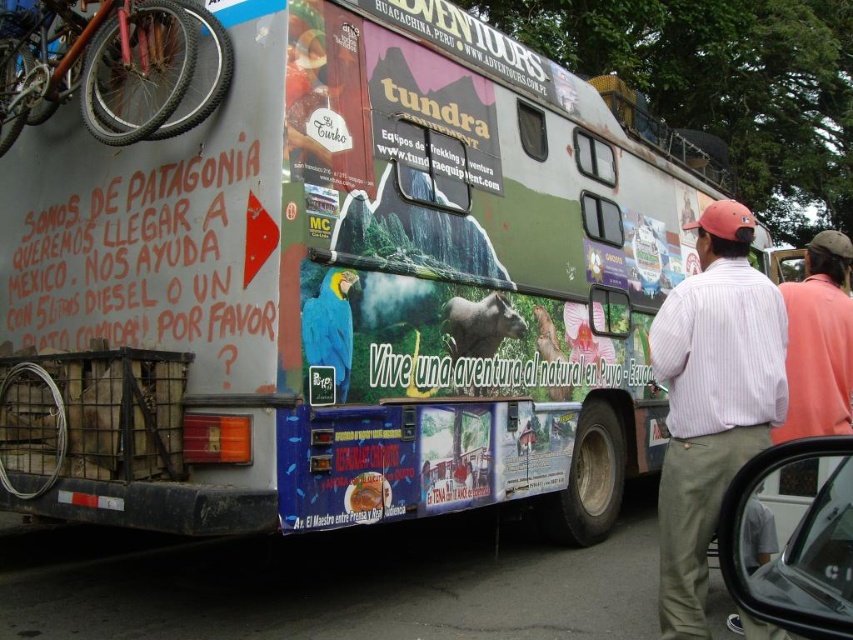
Question: Which of the following is the closest to the observer?

Choices:
 (A) (44, 58)
 (B) (711, 385)

Answer: (B)

Question: Does striped cotton shirt at right appear over orange matte bicycle at upper left?

Choices:
 (A) yes
 (B) no

Answer: (B)

Question: Is striped cotton shirt at right to the left of orange matte bicycle at upper left from the viewer's perspective?

Choices:
 (A) no
 (B) yes

Answer: (A)

Question: Can you confirm if striped cotton shirt at right is positioned to the left of orange matte bicycle at upper left?

Choices:
 (A) no
 (B) yes

Answer: (A)

Question: Which of the following is the farthest from the observer?

Choices:
 (A) (677, 536)
 (B) (91, 104)

Answer: (B)